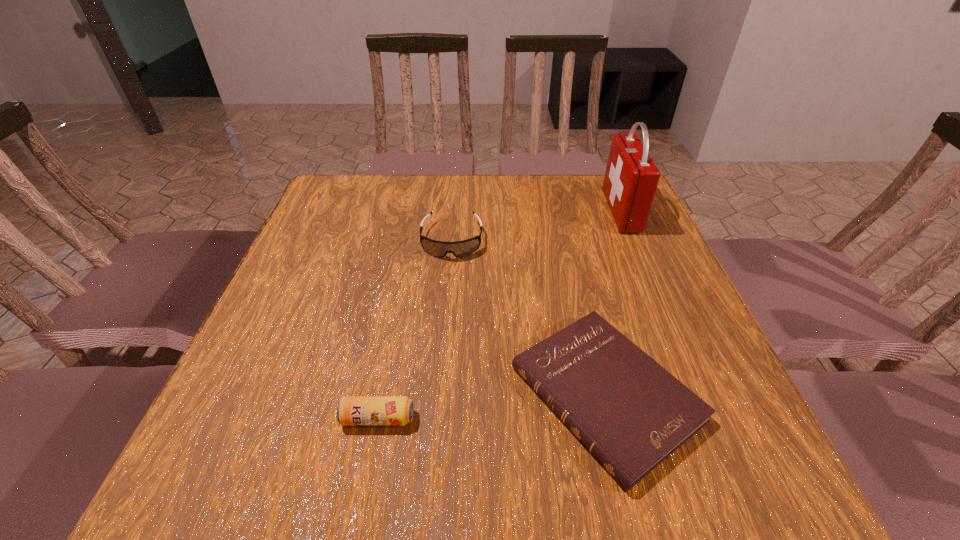
Locate an element on the screen. vacant point located between the beer can and the hardback book is located at coordinates (492, 406).

Where is `vacant area between the goggles and the first-aid kit`? This screenshot has height=540, width=960. vacant area between the goggles and the first-aid kit is located at coordinates (537, 226).

Image resolution: width=960 pixels, height=540 pixels. Identify the location of object that ranks as the second closest to the tallest object. (460, 249).

Choose which object is the nearest neighbor to the beer can. Please provide its 2D coordinates. Your answer should be formatted as a tuple, i.e. [(x, y)], where the tuple contains the x and y coordinates of a point satisfying the conditions above.

[(631, 413)]

Find the location of a particular element. The image size is (960, 540). vacant space that satisfies the following two spatial constraints: 1. on the front and sides of the goggles; 2. on the left side of the hardback book is located at coordinates (440, 394).

Find the location of a particular element. free location that satisfies the following two spatial constraints: 1. on the front face of the tallest object; 2. on the front and sides of the goggles is located at coordinates (634, 240).